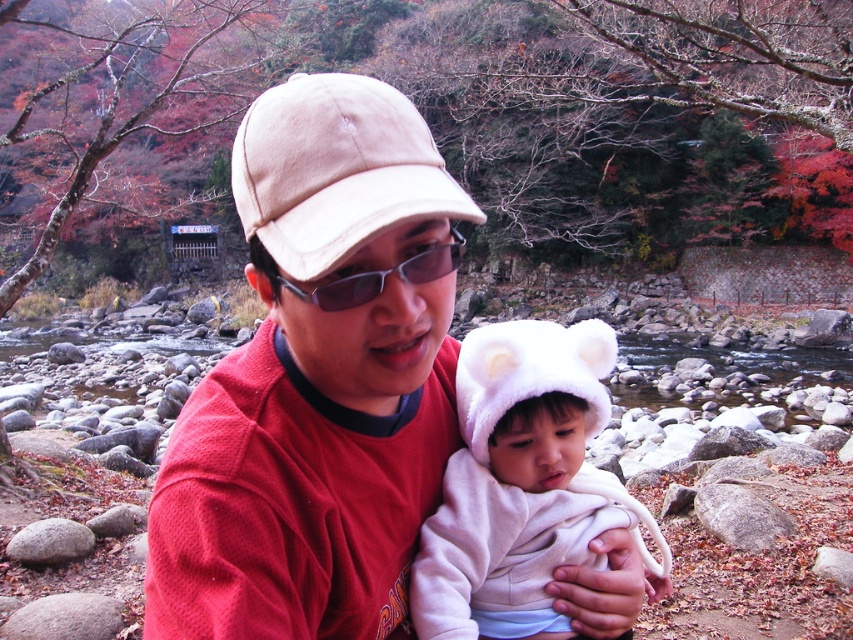
Question: Which of the following is the closest to the observer?

Choices:
 (A) sunglasses at center
 (B) beige suede cap at center

Answer: (B)

Question: Is beige suede cap at center positioned before sunglasses at center?

Choices:
 (A) yes
 (B) no

Answer: (A)

Question: Which point is farther from the camera taking this photo?

Choices:
 (A) (460, 259)
 (B) (553, 371)
 (C) (229, 356)
 (D) (570, 396)

Answer: (D)

Question: Can you confirm if matte red shirt at center is thinner than white fluffy hat at center?

Choices:
 (A) yes
 (B) no

Answer: (B)

Question: Does beige suede cap at center have a lesser width compared to sunglasses at center?

Choices:
 (A) no
 (B) yes

Answer: (A)

Question: Estimate the real-world distances between objects in this image. Which object is farther from the matte red shirt at center?

Choices:
 (A) beige suede cap at center
 (B) white fluffy hat at center

Answer: (B)